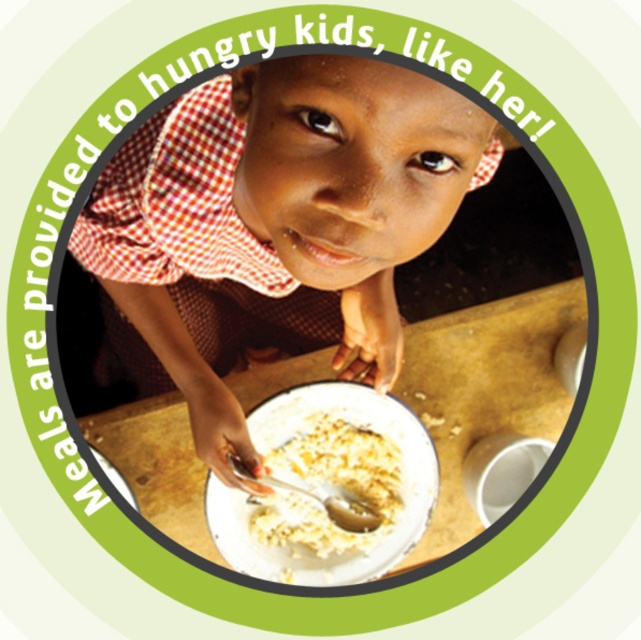
How much distance is there between matte brown shirt at center and white glossy plate at center?

matte brown shirt at center is 9.67 inches away from white glossy plate at center.

Does matte brown shirt at center have a smaller size compared to white glossy plate at center?

No, matte brown shirt at center is not smaller than white glossy plate at center.

Identify the location of matte brown shirt at center. (272, 227).

Which is above, matte brown shirt at center or white matte porridge at center?

matte brown shirt at center

Is matte brown shirt at center to the left of white matte porridge at center from the viewer's perspective?

Indeed, matte brown shirt at center is positioned on the left side of white matte porridge at center.

Is point (272, 248) closer to camera compared to point (319, 436)?

Yes.

Where is `matte brown shirt at center`? The width and height of the screenshot is (641, 640). matte brown shirt at center is located at coordinates (272, 227).

Is white glossy plate at center wider than white matte porridge at center?

Indeed, white glossy plate at center has a greater width compared to white matte porridge at center.

Between point (563, 328) and point (308, 477), which one is positioned behind?

The point (563, 328) is more distant.

Identify the location of white glossy plate at center. The height and width of the screenshot is (640, 641). (485, 390).

You are a GUI agent. You are given a task and a screenshot of the screen. Output one action in this format:
    pyautogui.click(x=<x>, y=<y>)
    Task: Click on the white glossy plate at center
    The width and height of the screenshot is (641, 640).
    Given the screenshot: What is the action you would take?
    pyautogui.click(x=485, y=390)